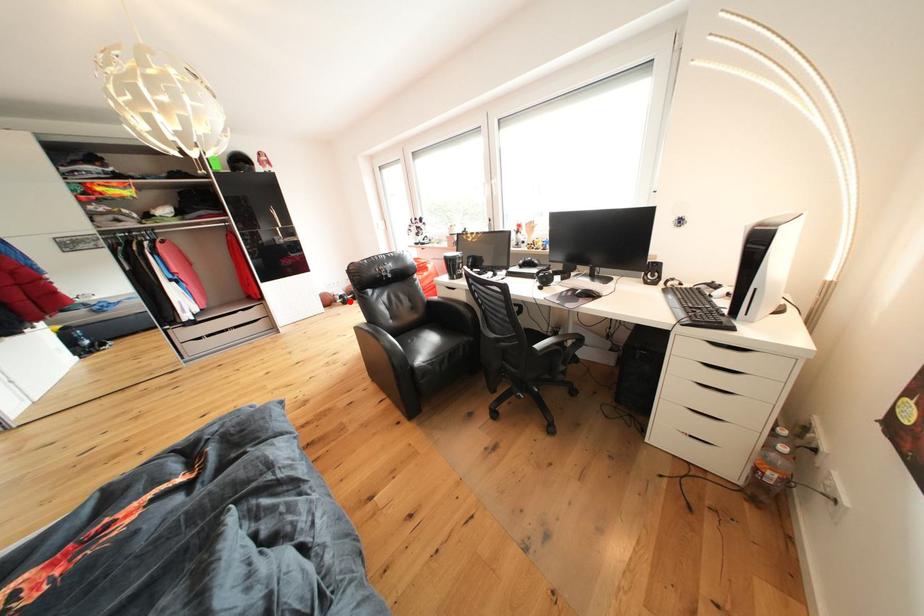
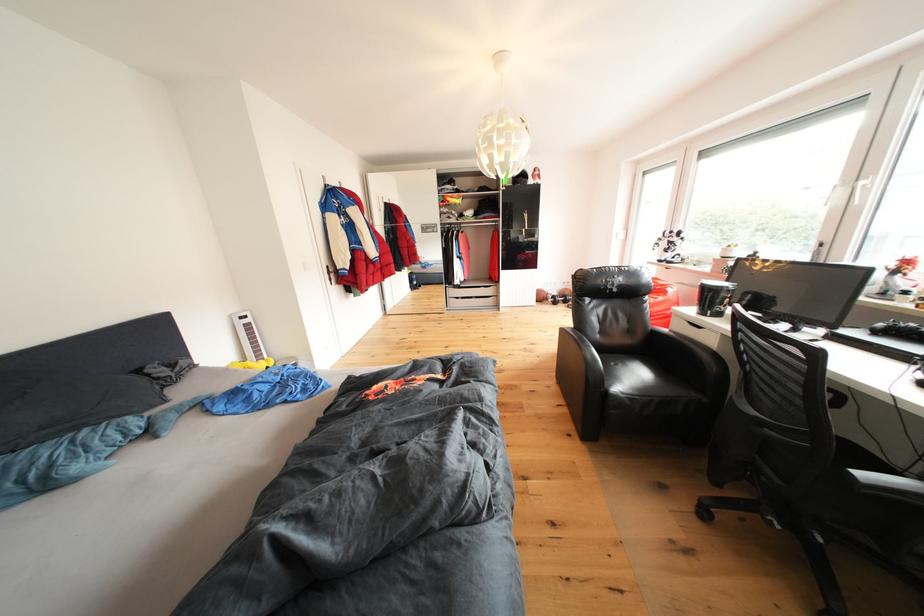
Question: I am providing you with two images of the same scene from different viewpoints. Given a red point in image1, look at the same physical point in image2. Is it:

Choices:
 (A) Closer to the viewpoint
 (B) Farther from the viewpoint

Answer: (A)